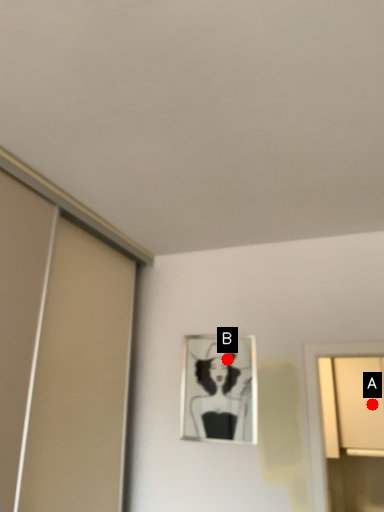
Question: Two points are circled on the image, labeled by A and B beside each circle. Which point is closer to the camera taking this photo?

Choices:
 (A) A is closer
 (B) B is closer

Answer: (B)